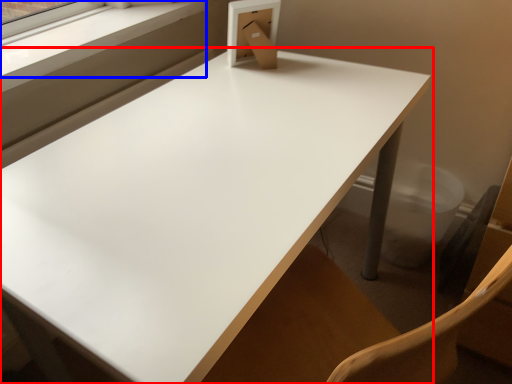
Question: Among these objects, which one is farthest to the camera, table (highlighted by a red box) or window frame (highlighted by a blue box)?

Choices:
 (A) table
 (B) window frame

Answer: (B)